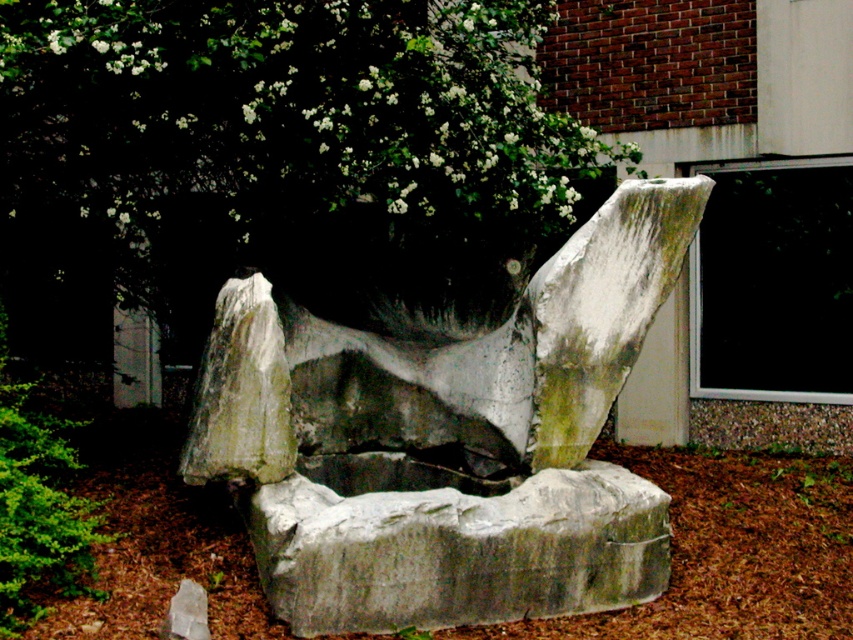
Which is behind, point (506, 106) or point (329, 630)?

The point (506, 106) is more distant.

Is green leafy tree at upper center above gray stone boulder at center?

Correct, green leafy tree at upper center is located above gray stone boulder at center.

Does point (367, 76) lie behind point (497, 616)?

Yes, point (367, 76) is behind point (497, 616).

Find the location of a particular element. The width and height of the screenshot is (853, 640). green leafy tree at upper center is located at coordinates (277, 124).

Is gray stone sculpture at center smaller than brown mulch at center?

No, gray stone sculpture at center is not smaller than brown mulch at center.

Is point (508, 481) behind point (729, 516)?

No, it is in front of (729, 516).

Measure the distance between gray stone sculpture at center and camera.

The distance of gray stone sculpture at center from camera is 16.47 feet.

Where is `gray stone sculpture at center`? The height and width of the screenshot is (640, 853). gray stone sculpture at center is located at coordinates (447, 438).

Does gray stone sculpture at center have a smaller size compared to gray stone boulder at center?

No.

Is point (637, 285) in front of point (451, 588)?

No.

Where is `gray stone sculpture at center`? The height and width of the screenshot is (640, 853). gray stone sculpture at center is located at coordinates (447, 438).